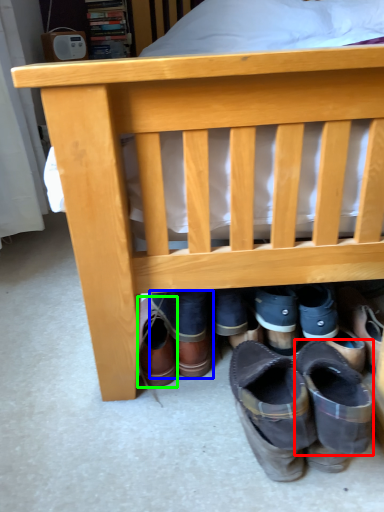
Question: Estimate the real-world distances between objects in this image. Which object is closer to shoe (highlighted by a red box), footwear (highlighted by a blue box) or footwear (highlighted by a green box)?

Choices:
 (A) footwear
 (B) footwear

Answer: (A)